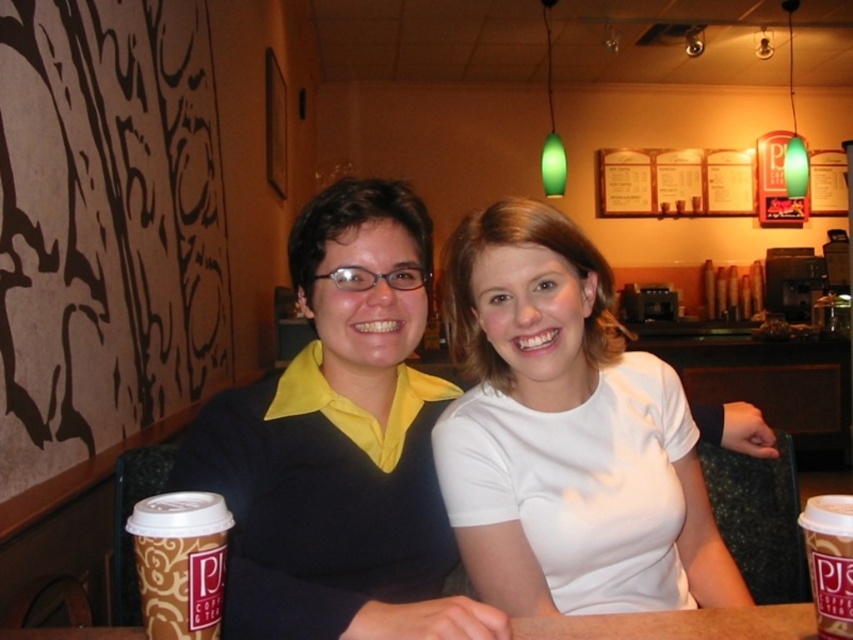
Is point (532, 538) positioned behind point (845, 540)?

Yes, point (532, 538) is farther from viewer.

Which is in front, point (540, 545) or point (846, 508)?

Point (846, 508) is in front.

This screenshot has width=853, height=640. Identify the location of white matte shirt at center. point(566,435).

Looking at this image, can you confirm if black matte shirt at center is taller than brown paper cup at lower right?

Yes.

Is black matte shirt at center bigger than brown paper cup at lower right?

Correct, black matte shirt at center is larger in size than brown paper cup at lower right.

This screenshot has width=853, height=640. Describe the element at coordinates (340, 444) in the screenshot. I see `black matte shirt at center` at that location.

You are a GUI agent. You are given a task and a screenshot of the screen. Output one action in this format:
    pyautogui.click(x=<x>, y=<y>)
    Task: Click on the black matte shirt at center
    
    Given the screenshot: What is the action you would take?
    pyautogui.click(x=340, y=444)

Looking at this image, can you confirm if brown paper cup at lower left is smaller than brown wooden table at center?

Actually, brown paper cup at lower left might be larger than brown wooden table at center.

Does point (183, 614) lie in front of point (572, 636)?

Yes, it is.

Is point (215, 573) in front of point (606, 636)?

Yes.

This screenshot has height=640, width=853. In order to click on brown paper cup at lower left in this screenshot , I will do `click(180, 563)`.